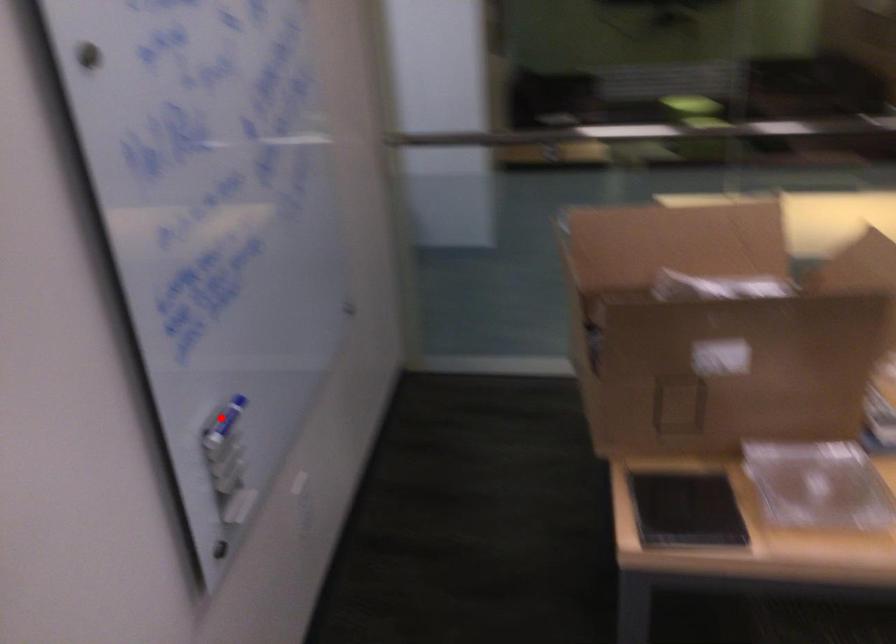
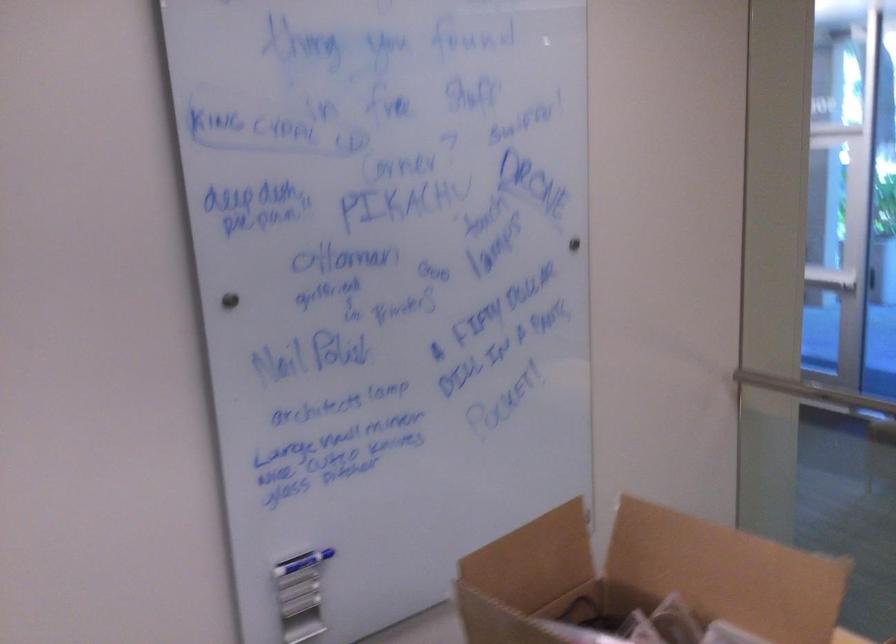
Question: I am providing you with two images of the same scene from different viewpoints. In image1, a red point is highlighted. Considering the same 3D point in image2, which of the following is correct?

Choices:
 (A) It is closer
 (B) It is farther

Answer: (B)